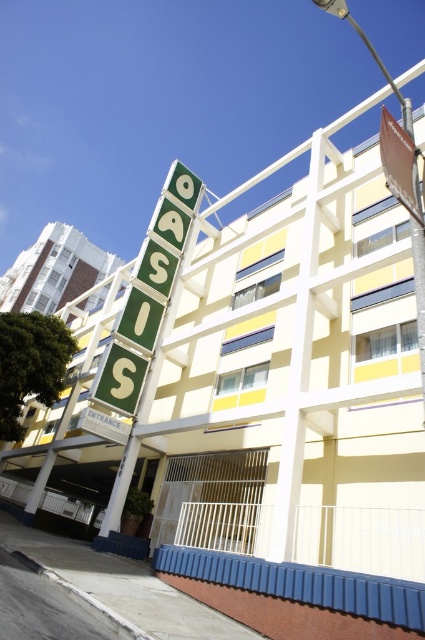
Question: Estimate the real-world distances between objects in this image. Which object is farther from the green matte sign at upper center?

Choices:
 (A) white concrete building at upper left
 (B) brown paper sign at upper right

Answer: (A)

Question: Considering the relative positions of green matte sign at upper center and white concrete building at upper left in the image provided, where is green matte sign at upper center located with respect to white concrete building at upper left?

Choices:
 (A) left
 (B) right

Answer: (B)

Question: Which of these objects is positioned farthest from the brown paper sign at upper right?

Choices:
 (A) green matte sign at upper center
 (B) white concrete building at upper left

Answer: (B)

Question: Where is green matte sign at upper center located in relation to brown paper sign at upper right in the image?

Choices:
 (A) above
 (B) below

Answer: (B)

Question: Which point is closer to the camera?

Choices:
 (A) brown paper sign at upper right
 (B) green matte sign at upper center
 (C) white concrete building at upper left

Answer: (A)

Question: Is white concrete building at upper left above brown paper sign at upper right?

Choices:
 (A) no
 (B) yes

Answer: (B)